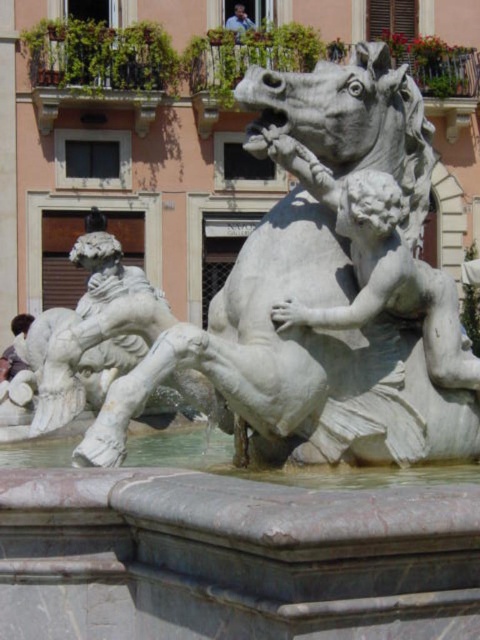
Does dark brown hair at lower left have a larger size compared to light blue shirt at upper center?

Yes.

Is point (31, 317) closer to camera compared to point (240, 22)?

Yes, it is.

The height and width of the screenshot is (640, 480). Find the location of `dark brown hair at lower left`. dark brown hair at lower left is located at coordinates (10, 364).

Can you confirm if white marble horse at center is shorter than dark brown hair at lower left?

No, white marble horse at center is not shorter than dark brown hair at lower left.

Can you confirm if white marble horse at center is thinner than dark brown hair at lower left?

In fact, white marble horse at center might be wider than dark brown hair at lower left.

Between point (372, 160) and point (13, 332), which one is positioned behind?

The point (13, 332) is more distant.

This screenshot has width=480, height=640. Find the location of `white marble horse at center`. white marble horse at center is located at coordinates (300, 358).

Which of these two, white marble horse at center or light blue shirt at upper center, stands shorter?

light blue shirt at upper center

Who is higher up, white marble horse at center or light blue shirt at upper center?

Positioned higher is light blue shirt at upper center.

Who is more distant from viewer, (409, 96) or (242, 20)?

Positioned behind is point (242, 20).

In order to click on white marble horse at center in this screenshot , I will do (300, 358).